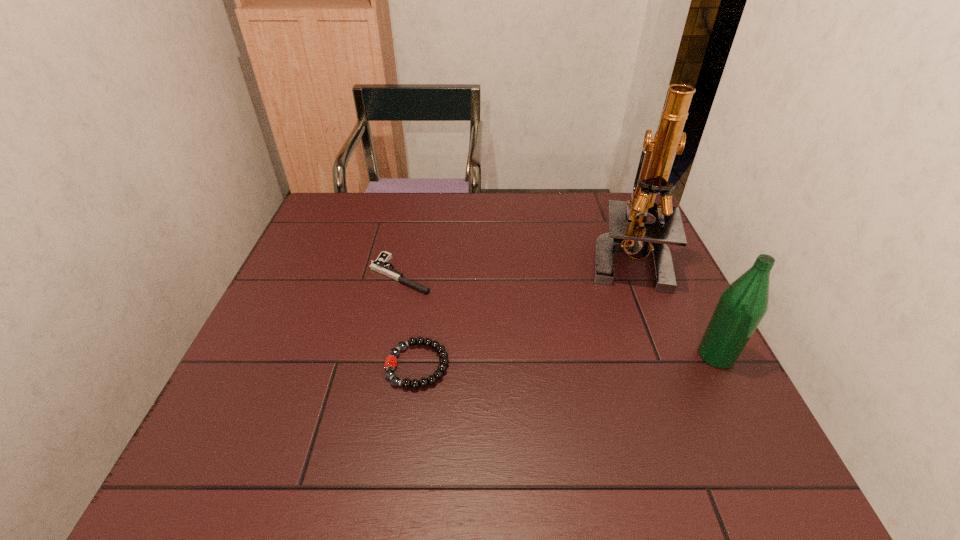
Find the location of a particular element. Image resolution: width=960 pixels, height=540 pixels. vacant point at the far left corner is located at coordinates (330, 220).

I want to click on vacant space at the near left corner, so click(279, 420).

I want to click on free space between the bracelet and the shortest object, so click(409, 320).

Locate an element on the screen. free space between the tallest object and the second tallest object is located at coordinates (671, 307).

This screenshot has height=540, width=960. Find the location of `vacant space in between the tallest object and the second tallest object`. vacant space in between the tallest object and the second tallest object is located at coordinates (671, 307).

Identify the location of free space between the pistol and the third shortest object. The height and width of the screenshot is (540, 960). (558, 315).

Locate an element on the screen. The width and height of the screenshot is (960, 540). free area in between the microscope and the pistol is located at coordinates (514, 266).

Where is `free space that is in between the second tallest object and the pistol`? free space that is in between the second tallest object and the pistol is located at coordinates (558, 315).

What are the coordinates of `vacant space in between the bracelet and the tallest object` in the screenshot? It's located at (522, 312).

The height and width of the screenshot is (540, 960). I want to click on free space between the shortest object and the microscope, so click(x=514, y=266).